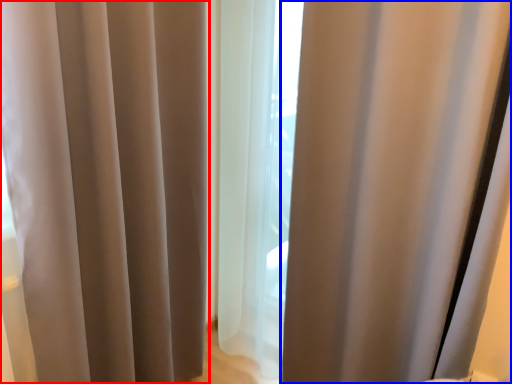
Question: Which object is further to the camera taking this photo, curtain (highlighted by a red box) or curtain (highlighted by a blue box)?

Choices:
 (A) curtain
 (B) curtain

Answer: (B)